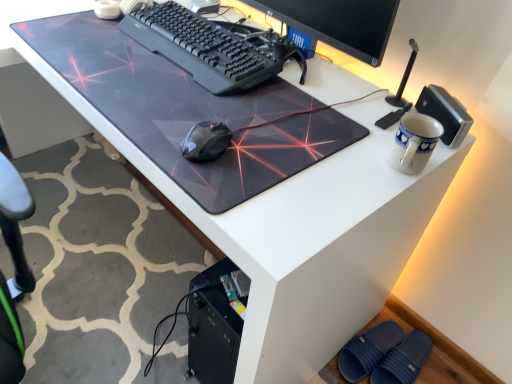
Identify the location of vacant area that is in front of blue ceramic mug at upper right. Image resolution: width=512 pixels, height=384 pixels. (364, 195).